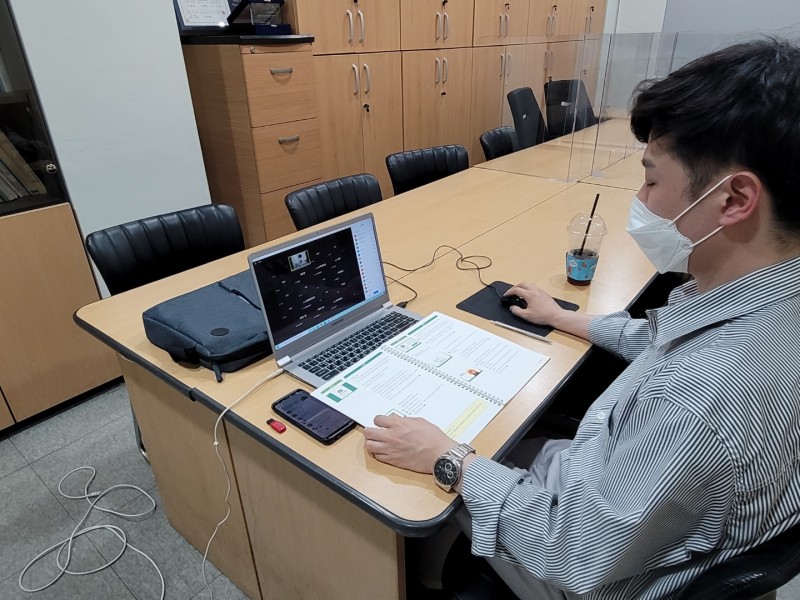
This screenshot has height=600, width=800. Find the location of `1 laptop`. 1 laptop is located at coordinates (310, 293).